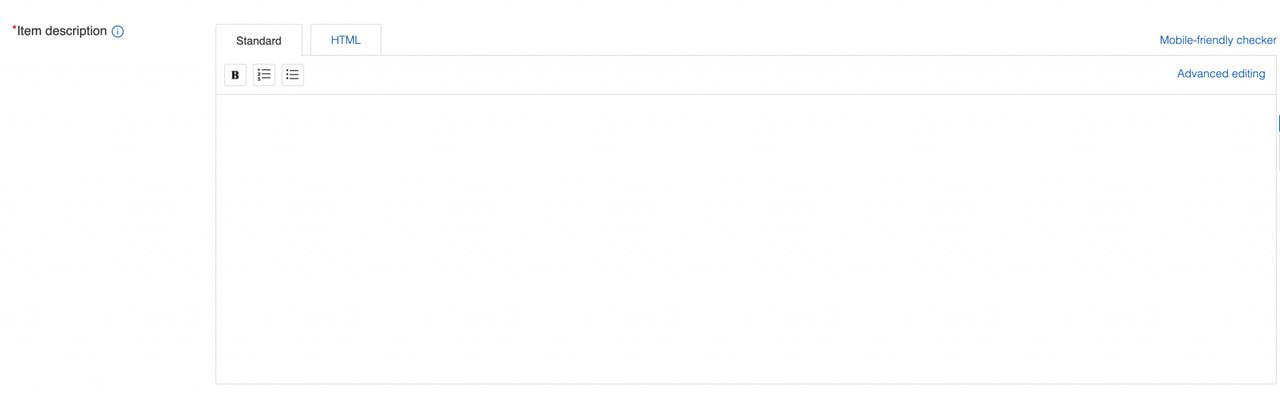
Locate an element on the screen. The width and height of the screenshot is (1280, 394). trash is located at coordinates (223, 73).